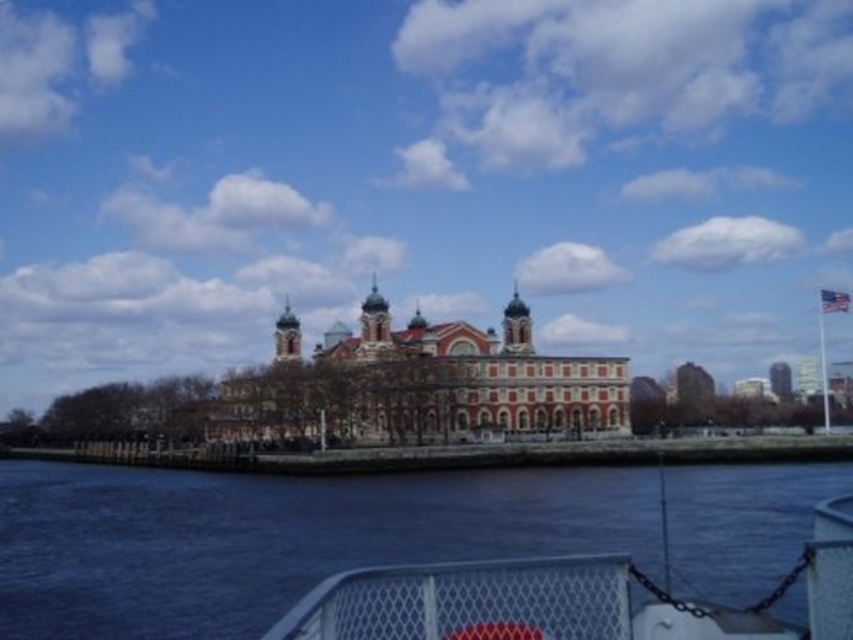
Question: Is dark blue water at lower center to the right of red brick building at center from the viewer's perspective?

Choices:
 (A) yes
 (B) no

Answer: (B)

Question: Among these points, which one is nearest to the camera?

Choices:
 (A) (297, 595)
 (B) (514, 369)

Answer: (A)

Question: Can you confirm if dark blue water at lower center is wider than red brick building at center?

Choices:
 (A) no
 (B) yes

Answer: (B)

Question: Considering the relative positions of dark blue water at lower center and red brick building at center in the image provided, where is dark blue water at lower center located with respect to red brick building at center?

Choices:
 (A) below
 (B) above

Answer: (A)